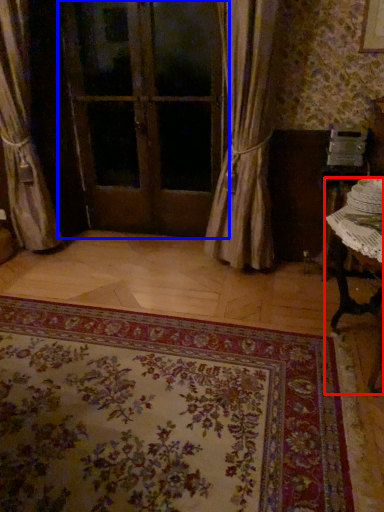
Question: Which object is closer to the camera taking this photo, table (highlighted by a red box) or door (highlighted by a blue box)?

Choices:
 (A) table
 (B) door

Answer: (A)